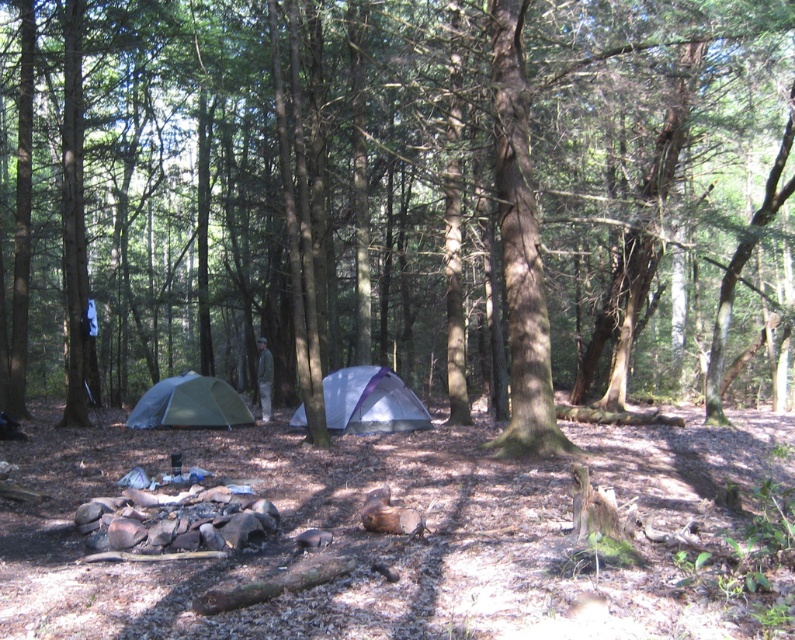
Question: Does brown rough tree at center appear under silver metallic tent at center?

Choices:
 (A) no
 (B) yes

Answer: (A)

Question: Which object is farther from the camera taking this photo?

Choices:
 (A) brown rough tree at center
 (B) silver metallic tent at center
 (C) green fabric tent at center

Answer: (C)

Question: Can you confirm if silver metallic tent at center is smaller than green fabric tent at center?

Choices:
 (A) no
 (B) yes

Answer: (A)

Question: Estimate the real-world distances between objects in this image. Which object is farther from the silver metallic tent at center?

Choices:
 (A) green fabric tent at center
 (B) brown rough tree at center

Answer: (B)

Question: Can you confirm if brown rough tree at center is positioned to the right of green fabric tent at center?

Choices:
 (A) yes
 (B) no

Answer: (A)

Question: Which point is closer to the camera taking this photo?

Choices:
 (A) (202, 401)
 (B) (402, 394)
 (C) (739, 134)

Answer: (B)